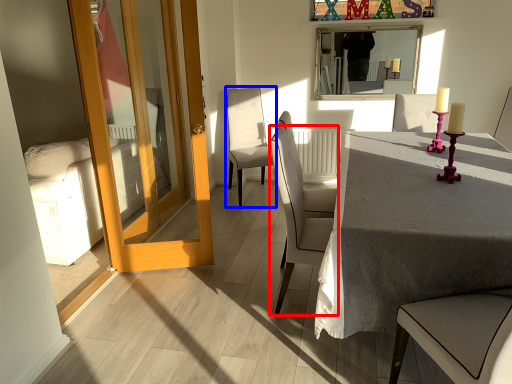
Question: Which point is further to the camera, chair (highlighted by a red box) or chair (highlighted by a blue box)?

Choices:
 (A) chair
 (B) chair

Answer: (B)